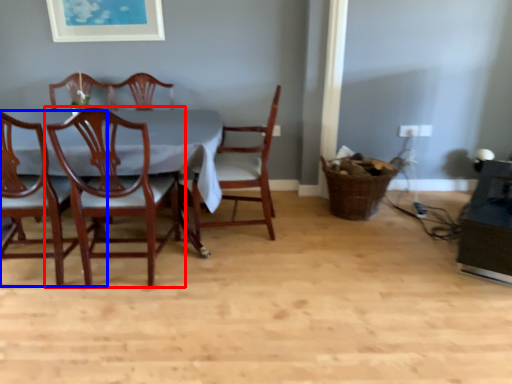
Question: Which point is further to the camera, chair (highlighted by a red box) or chair (highlighted by a blue box)?

Choices:
 (A) chair
 (B) chair

Answer: (A)